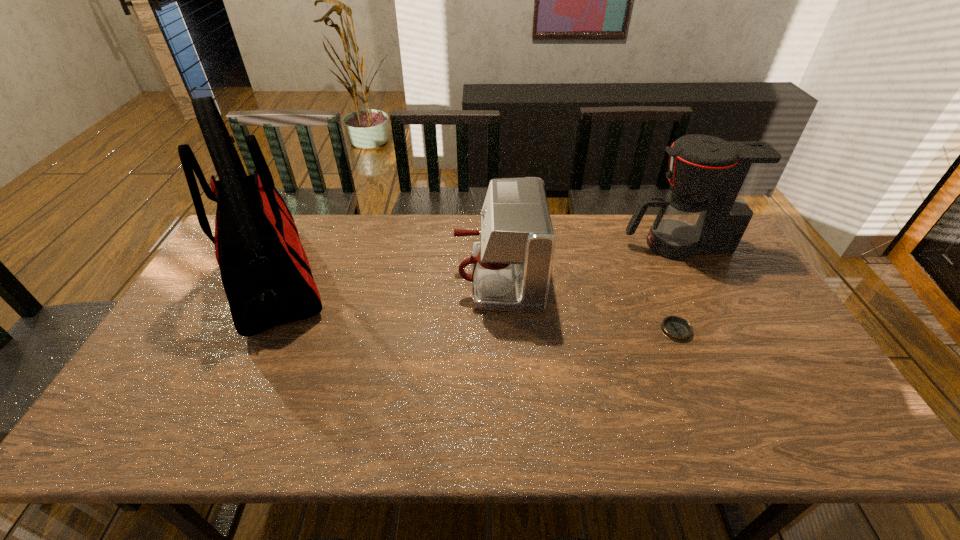
The height and width of the screenshot is (540, 960). I want to click on the tallest object, so click(x=265, y=272).

This screenshot has height=540, width=960. Identify the location of the leftmost object. (265, 272).

Locate an element on the screen. the taller coffee maker is located at coordinates (716, 185).

Where is `the second tallest object`? the second tallest object is located at coordinates (716, 185).

At what (x,y) coordinates should I click in order to perform the action: click on the third object from right to left. Please return your answer as a coordinate pair (x, y). The image size is (960, 540). Looking at the image, I should click on (511, 265).

Locate an element on the screen. the left coffee maker is located at coordinates (511, 265).

You are a GUI agent. You are given a task and a screenshot of the screen. Output one action in this format:
    pyautogui.click(x=<x>, y=<y>)
    Task: Click on the shortest object
    The width and height of the screenshot is (960, 540).
    Given the screenshot: What is the action you would take?
    pyautogui.click(x=676, y=328)

This screenshot has width=960, height=540. What are the coordinates of `vacant point located on the front of the leftmost object` in the screenshot? It's located at (215, 399).

Locate an element on the screen. This screenshot has height=540, width=960. vacant area situated pour from the carafe of the right coffee maker is located at coordinates (593, 245).

Find the location of a particular element. The height and width of the screenshot is (540, 960). vacant area situated 0.340m pour from the carafe of the right coffee maker is located at coordinates (522, 245).